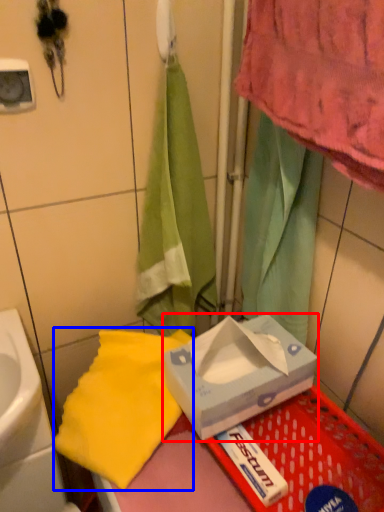
Question: Which object appears farthest to the camera in this image, box (highlighted by a red box) or beach towel (highlighted by a blue box)?

Choices:
 (A) box
 (B) beach towel

Answer: (B)